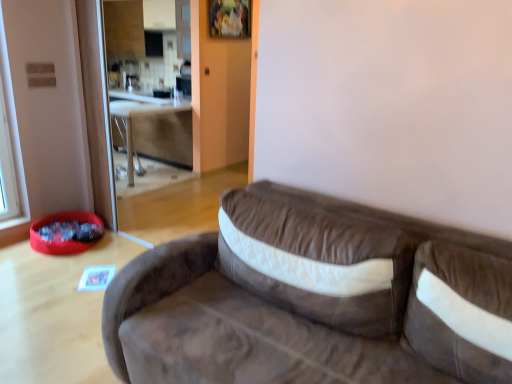
Question: In terms of size, does wooden table at center appear bigger or smaller than brown suede studio couch at center?

Choices:
 (A) small
 (B) big

Answer: (A)

Question: From a real-world perspective, is wooden table at center physically located above or below brown suede studio couch at center?

Choices:
 (A) below
 (B) above

Answer: (A)

Question: Is wooden table at center wider or thinner than brown suede studio couch at center?

Choices:
 (A) thin
 (B) wide

Answer: (A)

Question: Considering the positions of brown suede studio couch at center and wooden table at center in the image, is brown suede studio couch at center wider or thinner than wooden table at center?

Choices:
 (A) thin
 (B) wide

Answer: (B)

Question: Based on their sizes in the image, would you say brown suede studio couch at center is bigger or smaller than wooden table at center?

Choices:
 (A) big
 (B) small

Answer: (A)

Question: From a real-world perspective, is brown suede studio couch at center physically located above or below wooden table at center?

Choices:
 (A) above
 (B) below

Answer: (A)

Question: Is brown suede studio couch at center inside the boundaries of wooden table at center, or outside?

Choices:
 (A) outside
 (B) inside

Answer: (A)